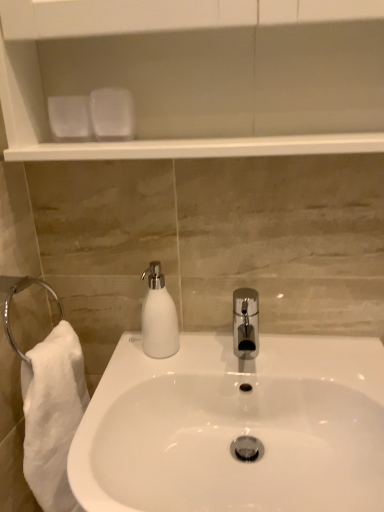
Find the location of a particular element. vacant area located to the right-hand side of white matte soap dispenser at center is located at coordinates (228, 352).